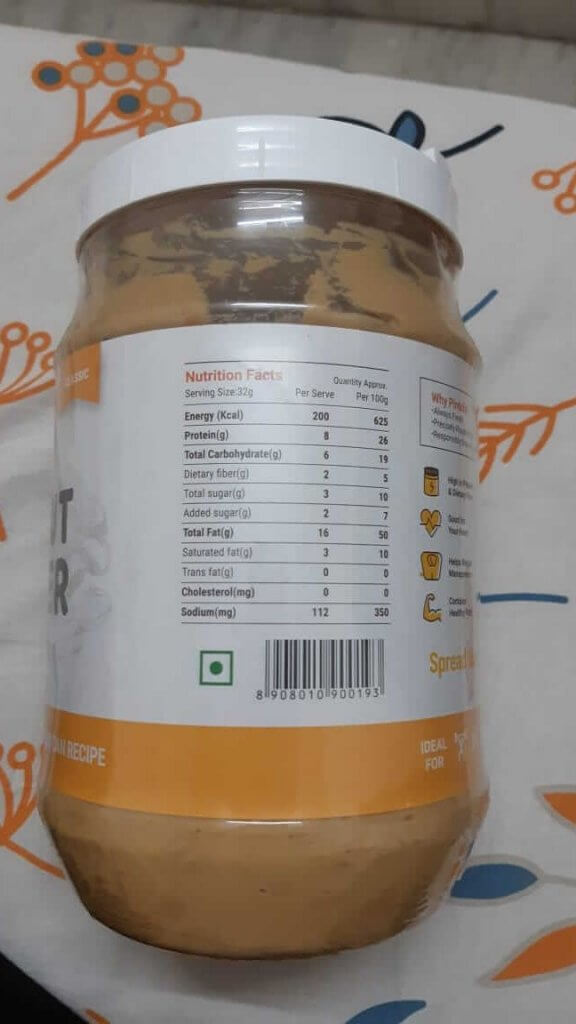
The height and width of the screenshot is (1024, 576). Identify the location of corner. (230, 649), (203, 650), (198, 682), (229, 682), (420, 379), (419, 444).